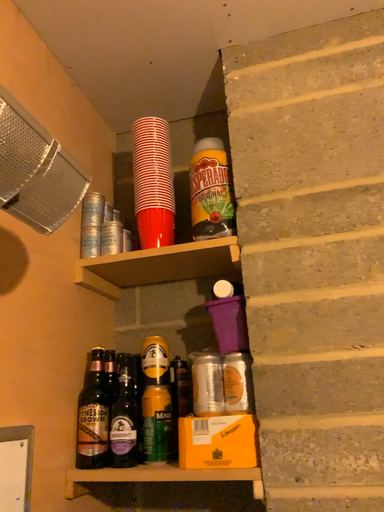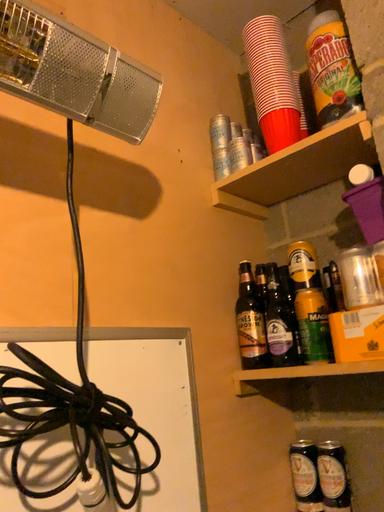
Question: How did the camera likely rotate when shooting the video?

Choices:
 (A) rotated right
 (B) rotated left

Answer: (B)